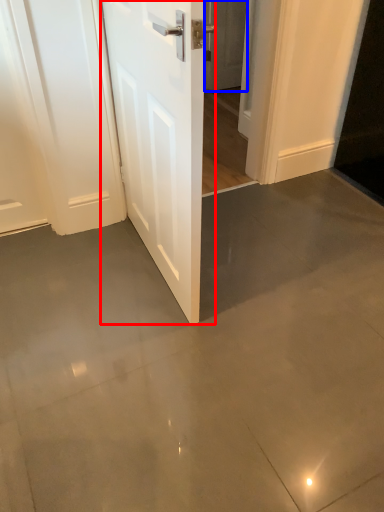
Question: Which of the following is the farthest to the observer, door (highlighted by a red box) or door (highlighted by a blue box)?

Choices:
 (A) door
 (B) door

Answer: (B)